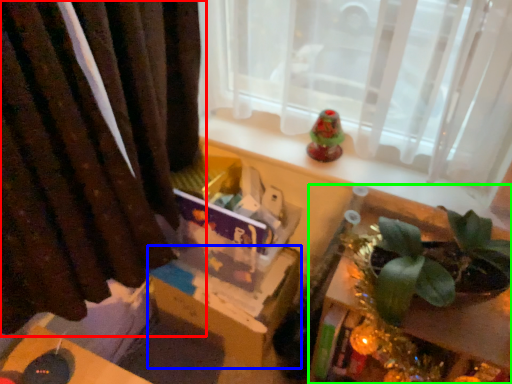
Question: Estimate the real-world distances between objects in this image. Which object is farther from curtain (highlighted by a red box), cardboard box (highlighted by a blue box) or table (highlighted by a green box)?

Choices:
 (A) cardboard box
 (B) table

Answer: (B)